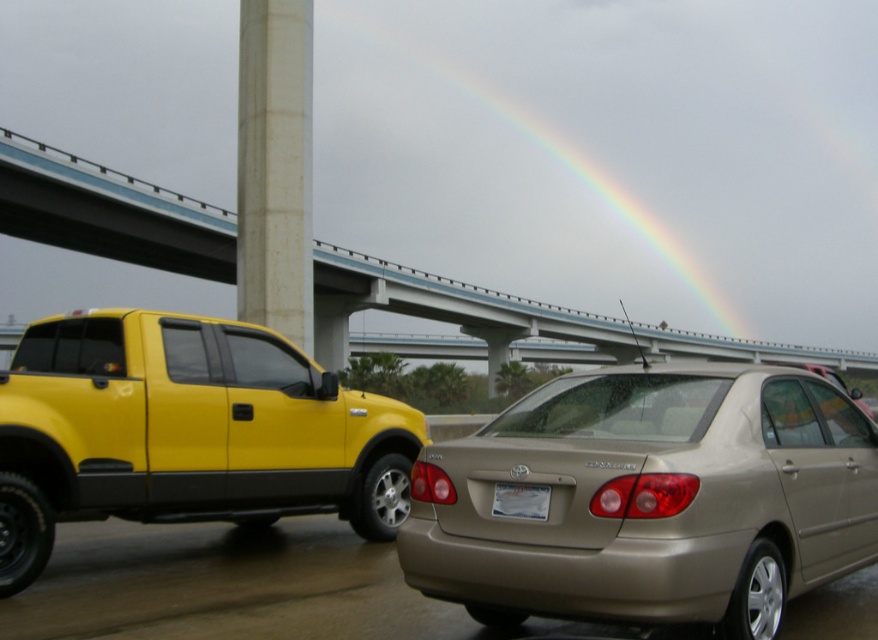
Can you confirm if shiny yellow truck at left is shorter than concrete bridge at upper center?

Correct, shiny yellow truck at left is not as tall as concrete bridge at upper center.

Image resolution: width=878 pixels, height=640 pixels. Identify the location of shiny yellow truck at left. (186, 433).

Is point (192, 326) in front of point (199, 266)?

That is True.

Identify the location of shiny yellow truck at left. (186, 433).

Is point (310, 412) positioned before point (261, 320)?

Yes, it is.

At what (x,y) coordinates should I click in order to perform the action: click on shiny yellow truck at left. Please return your answer as a coordinate pair (x, y). This screenshot has height=640, width=878. Looking at the image, I should click on (186, 433).

Locate an element on the screen. The image size is (878, 640). shiny yellow truck at left is located at coordinates (186, 433).

Can you confirm if shiny yellow truck at left is positioned below white plastic license plate at center?

Yes, shiny yellow truck at left is below white plastic license plate at center.

Between point (135, 490) and point (538, 509), which one is positioned behind?

Point (135, 490)

Is point (270, 426) farther from viewer compared to point (515, 506)?

Yes, it is.

This screenshot has height=640, width=878. Identify the location of shiny yellow truck at left. (186, 433).